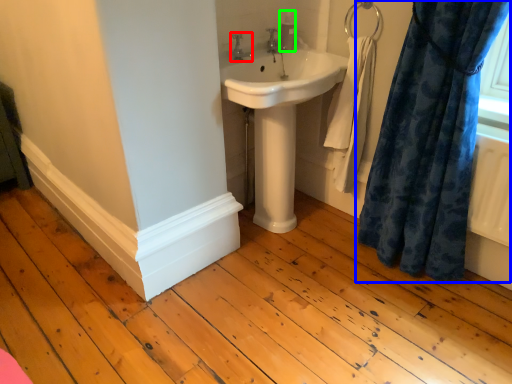
Question: Which object is the closest to the tap (highlighted by a red box)? Choose among these: curtain (highlighted by a blue box) or toiletry (highlighted by a green box).

Choices:
 (A) curtain
 (B) toiletry

Answer: (B)